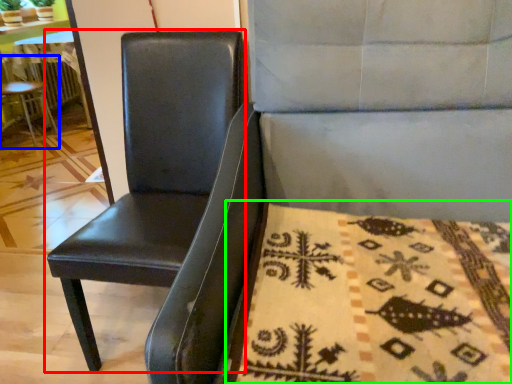
Question: Which is nearer to the chair (highlighted by a red box)? chair (highlighted by a blue box) or blanket (highlighted by a green box).

Choices:
 (A) chair
 (B) blanket

Answer: (B)